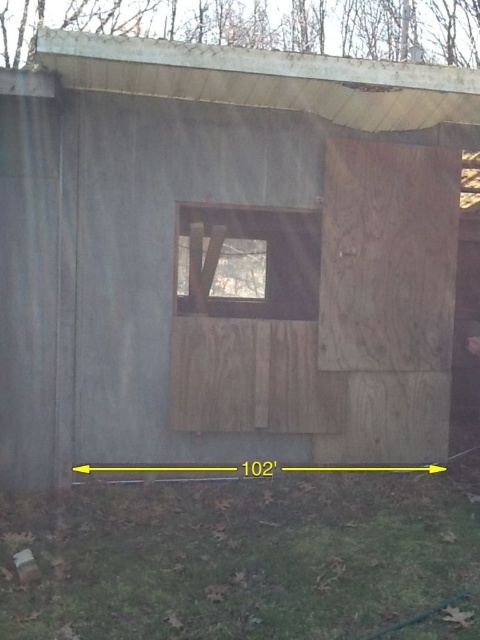
Question: Which of the following is the closest to the observer?

Choices:
 (A) transparent glass window at center
 (B) weathered wood hut at center

Answer: (B)

Question: In this image, where is weathered wood hut at center located relative to transparent glass window at center?

Choices:
 (A) left
 (B) right

Answer: (B)

Question: Is weathered wood hut at center further to camera compared to transparent glass window at center?

Choices:
 (A) yes
 (B) no

Answer: (B)

Question: Does weathered wood hut at center appear on the right side of transparent glass window at center?

Choices:
 (A) yes
 (B) no

Answer: (A)